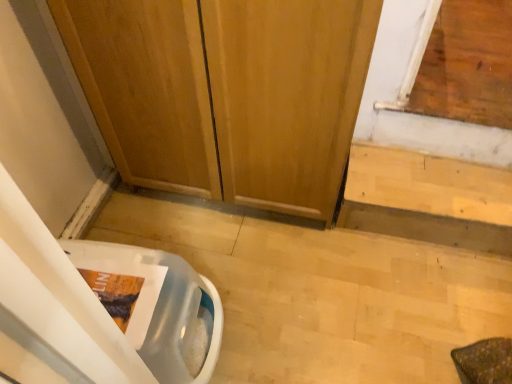
Question: Based on their positions, is light wood stairs at lower right located to the left or right of translucent plastic toilet bowl at lower left?

Choices:
 (A) right
 (B) left

Answer: (A)

Question: Considering the positions of light wood stairs at lower right and translucent plastic toilet bowl at lower left in the image, is light wood stairs at lower right bigger or smaller than translucent plastic toilet bowl at lower left?

Choices:
 (A) small
 (B) big

Answer: (A)

Question: Considering the real-world distances, which object is farthest from the translucent plastic toilet bowl at lower left?

Choices:
 (A) light wood stairs at lower right
 (B) wooden door at center

Answer: (A)

Question: Based on their relative distances, which object is nearer to the light wood stairs at lower right?

Choices:
 (A) wooden door at center
 (B) translucent plastic toilet bowl at lower left

Answer: (A)